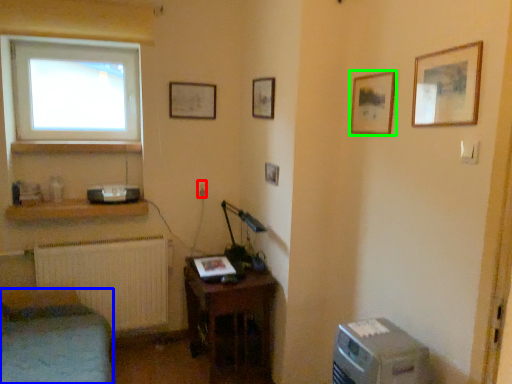
Question: Which object is the closest to the electric outlet (highlighted by a red box)? Choose among these: furniture (highlighted by a blue box) or picture frame (highlighted by a green box).

Choices:
 (A) furniture
 (B) picture frame

Answer: (A)